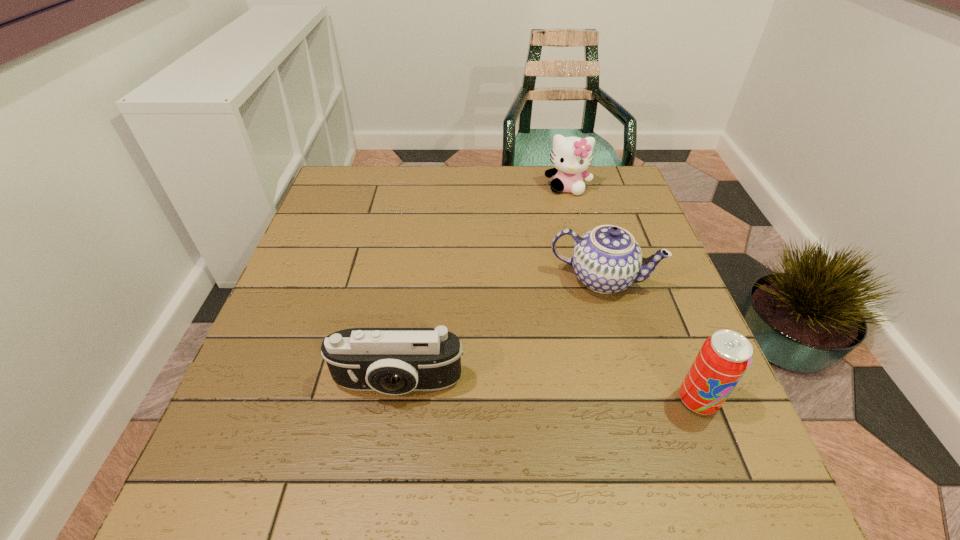
Identify the location of camera. This screenshot has height=540, width=960. (394, 361).

Identify the location of soda can. This screenshot has height=540, width=960. (724, 357).

Locate an element on the screen. The image size is (960, 540). the third nearest object is located at coordinates (607, 259).

In order to click on the farthest object in this screenshot , I will do `click(571, 156)`.

Locate an element on the screen. free space located on the front lens of the leftmost object is located at coordinates (390, 434).

Where is `free location located on the left of the soda can`? The image size is (960, 540). free location located on the left of the soda can is located at coordinates (461, 400).

The height and width of the screenshot is (540, 960). What are the coordinates of `vacant space situated 0.230m at the spout of the second farthest object` in the screenshot? It's located at (564, 384).

The width and height of the screenshot is (960, 540). Identify the location of free space located 0.220m at the spout of the second farthest object. (565, 380).

Locate an element on the screen. This screenshot has width=960, height=540. free spot located 0.280m at the spout of the second farthest object is located at coordinates (558, 407).

The height and width of the screenshot is (540, 960). Find the location of `vacant region located 0.150m on the front-facing side of the farthest object`. vacant region located 0.150m on the front-facing side of the farthest object is located at coordinates (564, 228).